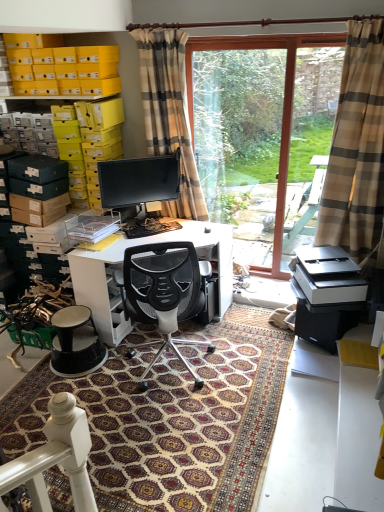
You are a GUI agent. You are given a task and a screenshot of the screen. Output one action in this format:
    pyautogui.click(x=<x>, y=<y>)
    Task: Click on the empty space that is ontop of plaid fabric curtain at center, marked as the first curtain in a left-to-right arrangement (from a real-world perspective)
    
    Given the screenshot: What is the action you would take?
    pyautogui.click(x=163, y=26)